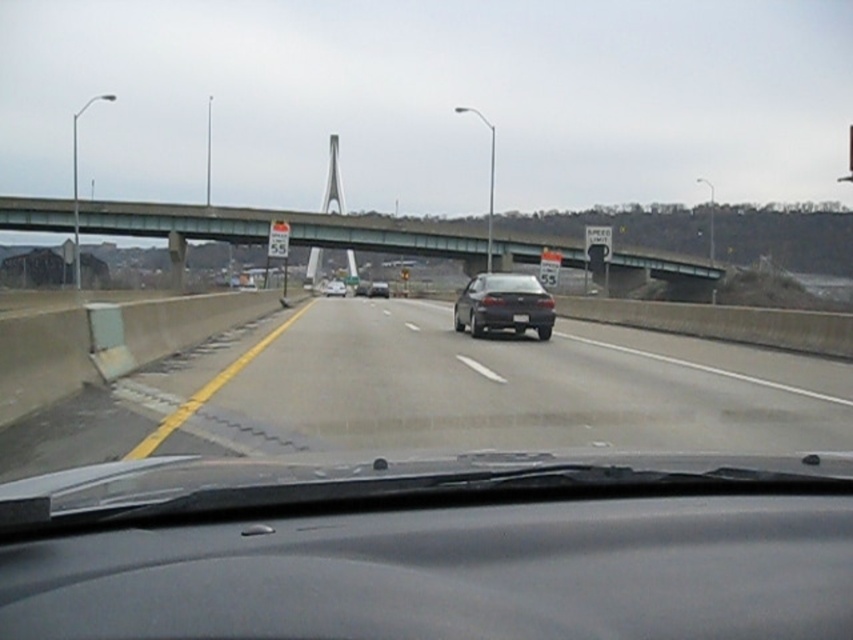
Where is `concrete barrier at lower left`? This screenshot has height=640, width=853. concrete barrier at lower left is located at coordinates (440, 392).

Is point (119, 429) positioned in front of point (329, 292)?

Yes, point (119, 429) is closer to viewer.

The width and height of the screenshot is (853, 640). Identify the location of concrete barrier at lower left. (440, 392).

Which is more to the left, satin black sedan at center or shiny silver sedan at center?

shiny silver sedan at center

Between satin black sedan at center and shiny silver sedan at center, which one is positioned higher?

shiny silver sedan at center

Identify the location of satin black sedan at center. (503, 305).

Between green concrete bridge at upper center and shiny black sedan at center, which one is positioned lower?

shiny black sedan at center is below.

Between point (462, 241) and point (345, 294), which one is positioned in front?

Point (462, 241) is in front.

Consider the image. Who is more forward, (x=538, y=244) or (x=338, y=291)?

Point (x=538, y=244) is in front.

The image size is (853, 640). What are the coordinates of `green concrete bridge at upper center` in the screenshot? It's located at coord(289,227).